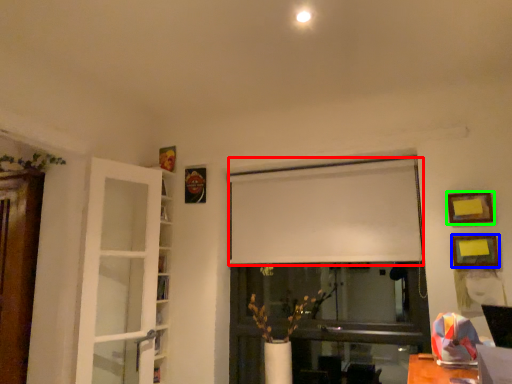
Question: Which is nearer to the curtain (highlighted by a red box)? picture frame (highlighted by a blue box) or picture frame (highlighted by a green box).

Choices:
 (A) picture frame
 (B) picture frame

Answer: (B)